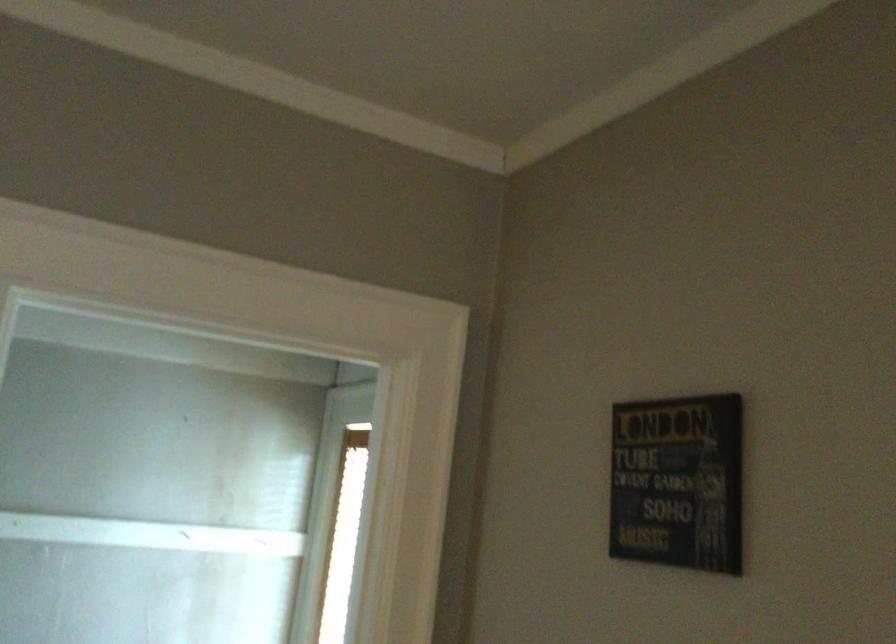
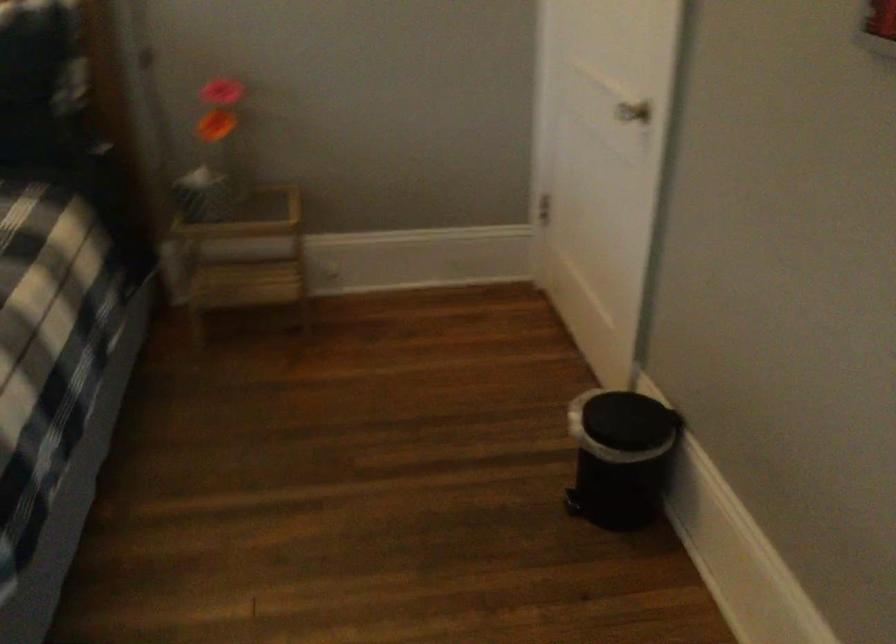
Question: How did the camera likely rotate?

Choices:
 (A) Left
 (B) Right
 (C) Up
 (D) Down

Answer: (A)